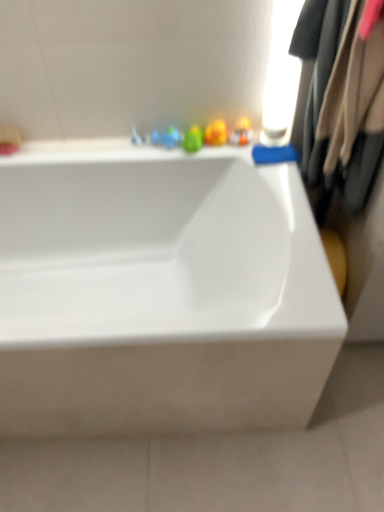
Question: From the image's perspective, is beige fabric coat at right above or below translucent plastic toy at upper center?

Choices:
 (A) above
 (B) below

Answer: (B)

Question: Looking at their shapes, would you say beige fabric coat at right is wider or thinner than translucent plastic toy at upper center?

Choices:
 (A) wide
 (B) thin

Answer: (A)

Question: Based on their relative distances, which object is nearer to the translucent plastic toy at upper center?

Choices:
 (A) beige fabric coat at right
 (B) white glossy bathtub at center

Answer: (A)

Question: Which object is the farthest from the translucent plastic toy at upper center?

Choices:
 (A) white glossy bathtub at center
 (B) beige fabric coat at right

Answer: (A)